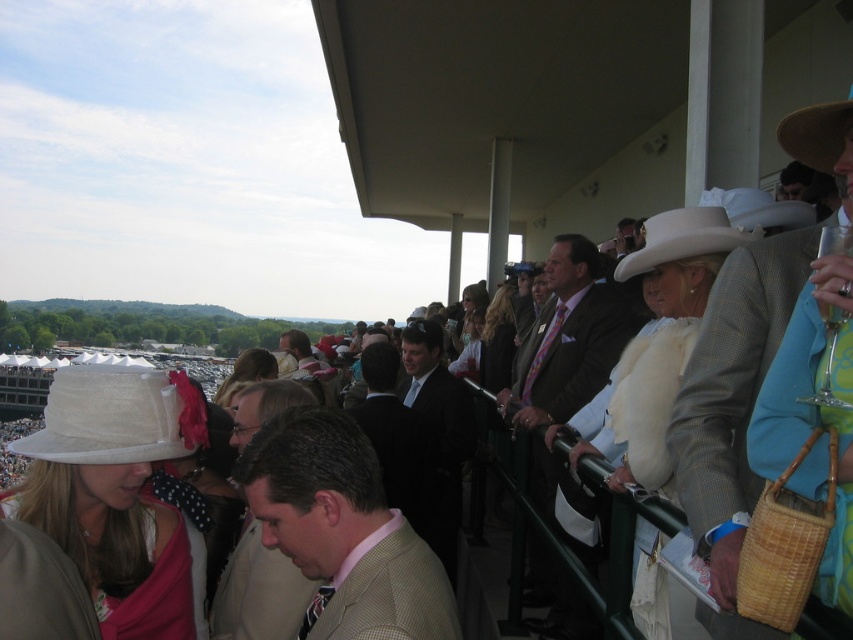
Question: Which object is the closest to the white felt cowboy hat at upper right?

Choices:
 (A) tan textured suit at center
 (B) black suit at center
 (C) brown straw cowboy hat at upper right

Answer: (C)

Question: Which of these objects is positioned farthest from the light brown leather jacket at center?

Choices:
 (A) white felt cowboy hat at upper right
 (B) matte brown suit at center
 (C) tan textured suit at center
 (D) black suit at center

Answer: (D)

Question: Can you confirm if matte brown suit at center is positioned to the right of white fabric hat at left?

Choices:
 (A) yes
 (B) no

Answer: (A)

Question: Is white fabric hat at left wider than brown straw cowboy hat at upper right?

Choices:
 (A) yes
 (B) no

Answer: (A)

Question: From the image, what is the correct spatial relationship of white felt cowboy hat at upper right in relation to brown straw cowboy hat at upper right?

Choices:
 (A) below
 (B) above

Answer: (A)

Question: Among these points, which one is nearest to the camera?

Choices:
 (A) (61, 424)
 (B) (810, 129)

Answer: (B)